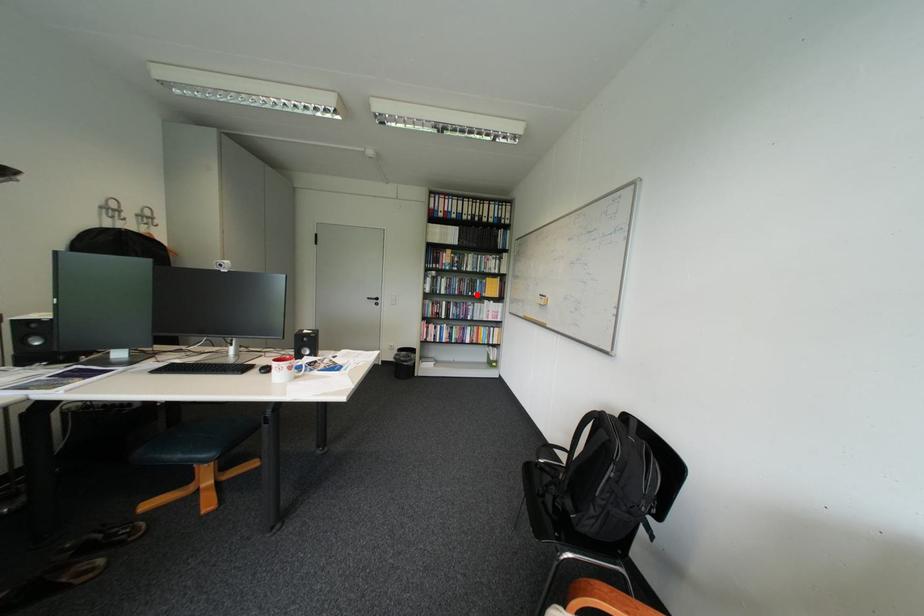
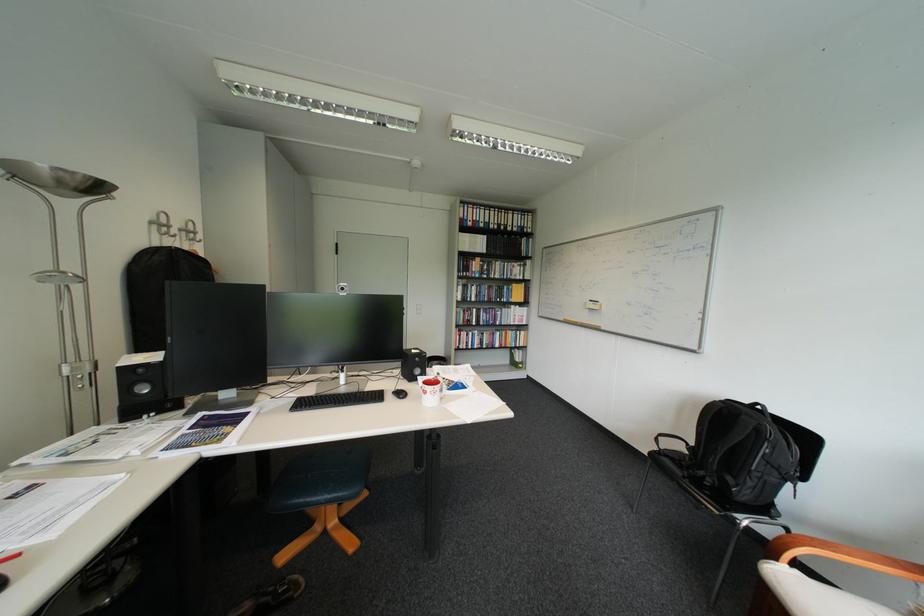
Locate, in the second image, the point that corresponds to the highlighted location in the first image.

(505, 301)